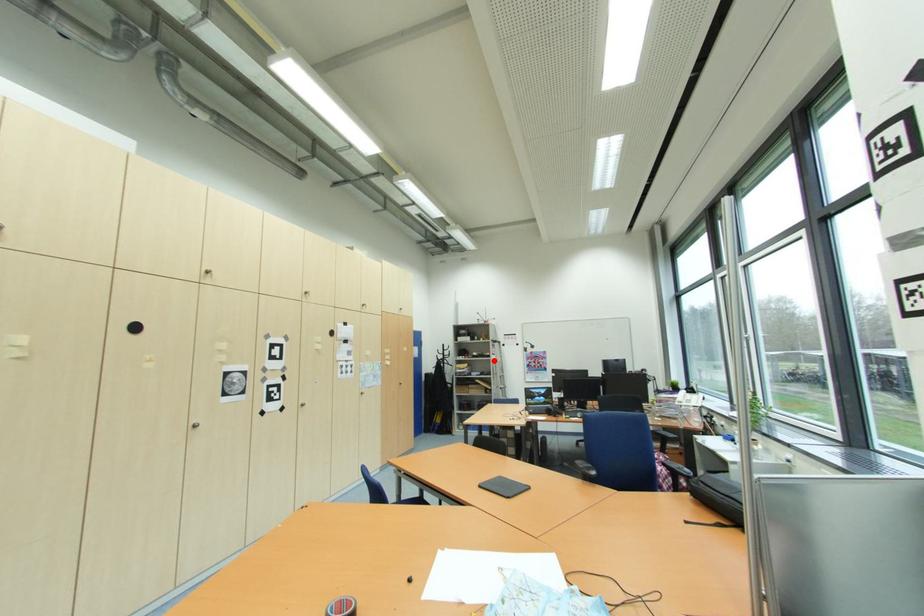
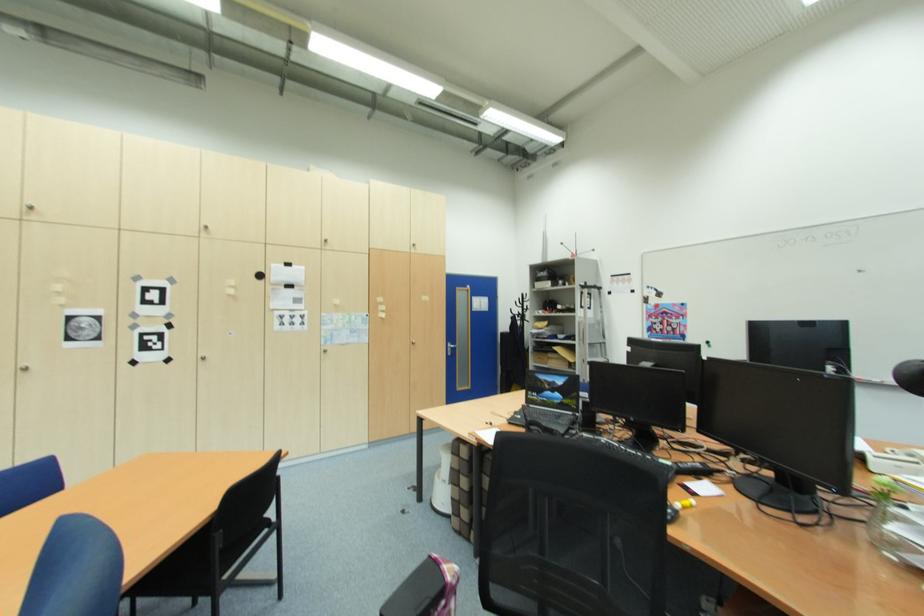
Where in the second image is the point corresponding to the highlighted location from the first image?

(578, 317)